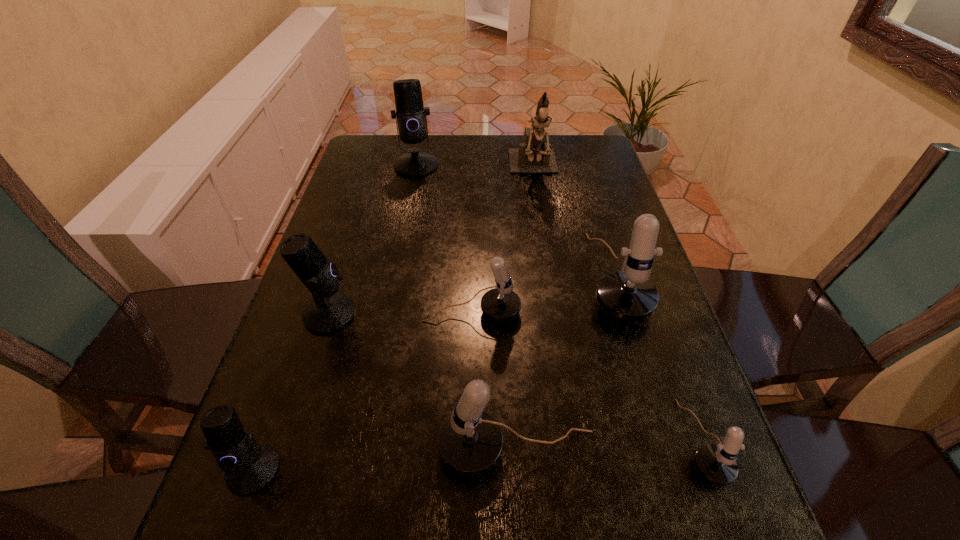
Identify the location of vacant space at the left edge of the desktop. (283, 512).

In the image, there is a desktop. Where is `vacant space at the right edge`? vacant space at the right edge is located at coordinates (612, 225).

Where is `vacant space at the far left corner of the desktop`? vacant space at the far left corner of the desktop is located at coordinates (385, 138).

Find the location of a particular element. vacant area at the far right corner of the desktop is located at coordinates (605, 151).

This screenshot has height=540, width=960. I want to click on empty space that is in between the biggest white microphone and the figurine, so click(574, 224).

Where is `vacant space in between the second farthest black microphone and the brown figurine`? This screenshot has width=960, height=540. vacant space in between the second farthest black microphone and the brown figurine is located at coordinates (431, 242).

Image resolution: width=960 pixels, height=540 pixels. In order to click on unoccupied area between the second biggest white microphone and the shortest microphone in this screenshot , I will do `click(610, 446)`.

Where is `free spot between the farthest microphone and the third biggest white microphone`? This screenshot has height=540, width=960. free spot between the farthest microphone and the third biggest white microphone is located at coordinates (444, 239).

At what (x,y) coordinates should I click in order to perform the action: click on empty space between the second smallest white microphone and the biggest white microphone. Please return your answer as a coordinate pair (x, y). Image resolution: width=960 pixels, height=540 pixels. Looking at the image, I should click on (542, 295).

This screenshot has width=960, height=540. I want to click on free spot between the shortest microphone and the second biggest white microphone, so click(x=610, y=446).